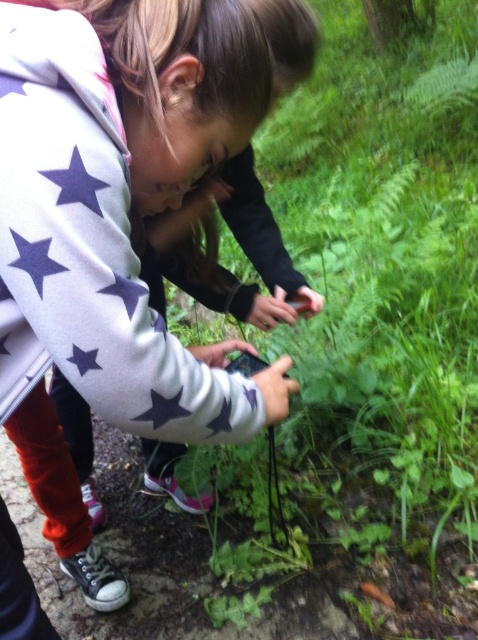
You are a drone operator trying to capture a photo of the green leafy plant at center. Your drone is currently at point 0.5,0.7. Should you move north or south to get closer to the plant?

The green leafy plant at center is at point [366,352]. Since the drone is at [334,320], moving north would increase the y coordinate from 0.7 to 0.766, so you should move north.